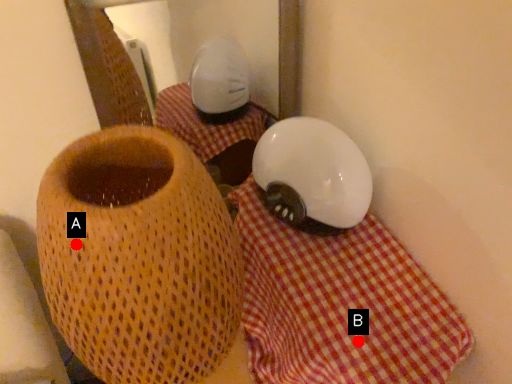
Question: Two points are circled on the image, labeled by A and B beside each circle. Which point is farther from the camera taking this photo?

Choices:
 (A) A is further
 (B) B is further

Answer: (B)